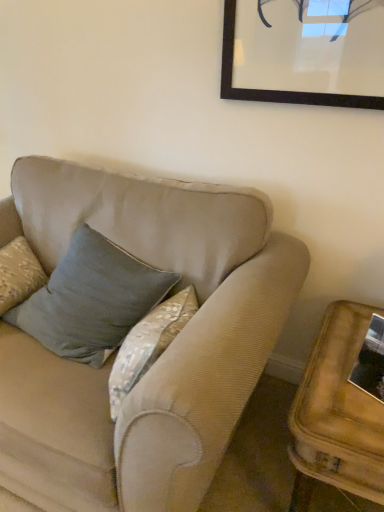
Locate an element on the screen. This screenshot has height=512, width=384. free point in front of metallic reflective frame at lower right is located at coordinates (362, 424).